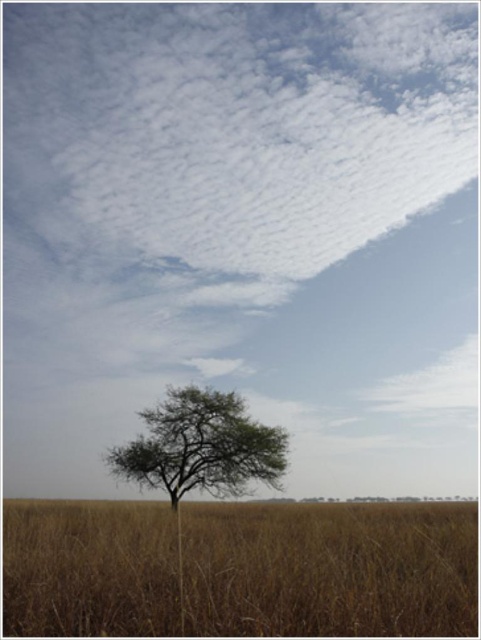
You are a hiker who wants to take a photo of the green leafy tree at center. However, the brown dry grass at lower center is blocking your view. Can you determine if the grass is taller than the tree?

The brown dry grass at lower center is much taller as green leafy tree at center, so yes, the grass is taller than the tree, blocking your view.

You are a hiker who wants to take a photo of the green leafy tree at center. However, you notice that the brown dry grass at lower center might block the view. Based on their sizes, which object would you need to move closer to or farther from to ensure the tree is fully visible in your photo?

The brown dry grass at lower center is larger in size than the green leafy tree at center. To ensure the tree is fully visible, you should move closer to the tree so that the grass appears smaller relative to the tree in the frame.

You are standing in the middle of the grassland looking at the solitary tree. There is a specific point marked at coordinates point (329, 570). What is located at this point?

The brown dry grass at lower center is located at point (329, 570).